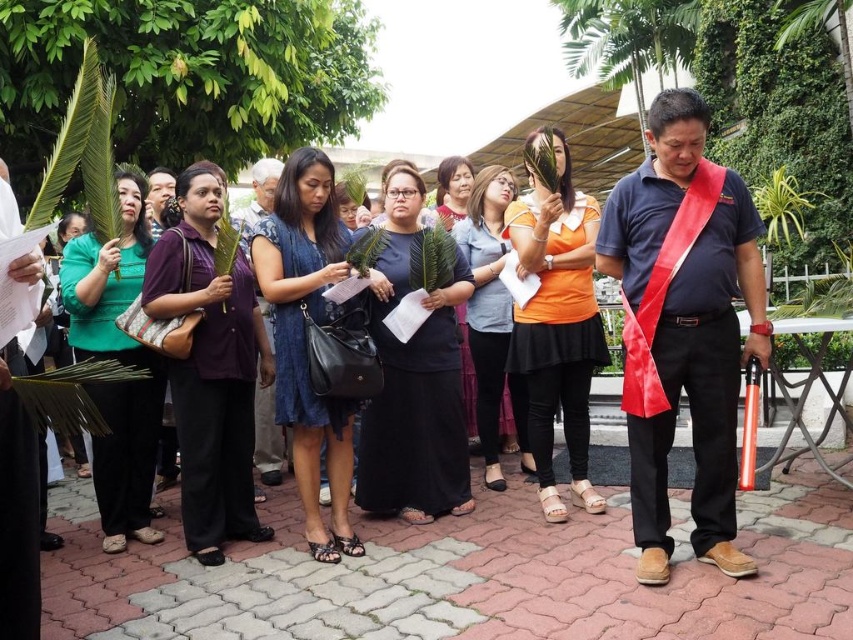
Question: Can you confirm if purple fabric dress at center is positioned to the right of blue denim dress at center?

Choices:
 (A) yes
 (B) no

Answer: (B)

Question: Which point is closer to the camera taking this photo?

Choices:
 (A) (503, 296)
 (B) (402, 477)

Answer: (B)

Question: From the image, what is the correct spatial relationship of blue denim dress at center in relation to orange matte shirt at center?

Choices:
 (A) above
 (B) below

Answer: (B)

Question: Which of the following is the closest to the observer?

Choices:
 (A) (140, 252)
 (B) (524, 332)

Answer: (B)

Question: Does orange matte shirt at center have a lesser width compared to matte gray dress at center?

Choices:
 (A) no
 (B) yes

Answer: (A)

Question: Which object is positioned closest to the purple fabric dress at center?

Choices:
 (A) matte purple dress at center
 (B) black matte dress at center

Answer: (A)